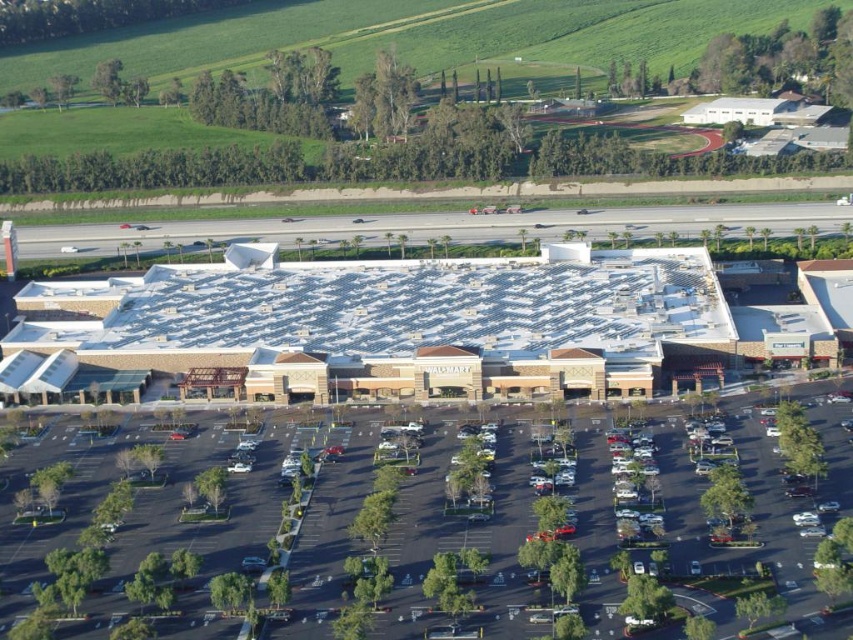
You are a drone operator trying to capture a clear photo of the Walmart entrance. You notice two parking lots in the image, the black asphalt parking lot at center and the dark gray asphalt parking lot at center. Which parking lot is nearer to your drone?

The black asphalt parking lot at center is closer to the viewer than the dark gray asphalt parking lot at center, so the black asphalt parking lot at center is nearer to the drone.